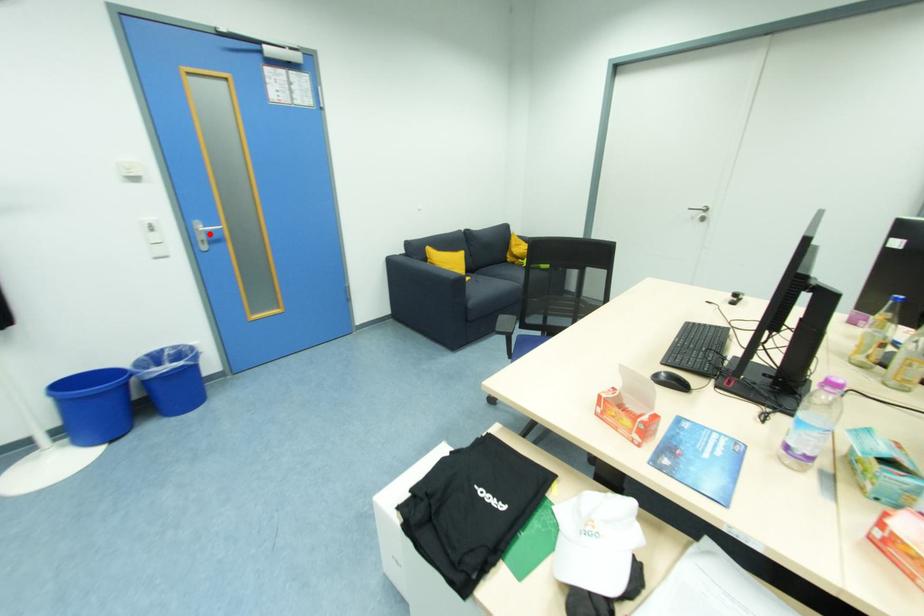
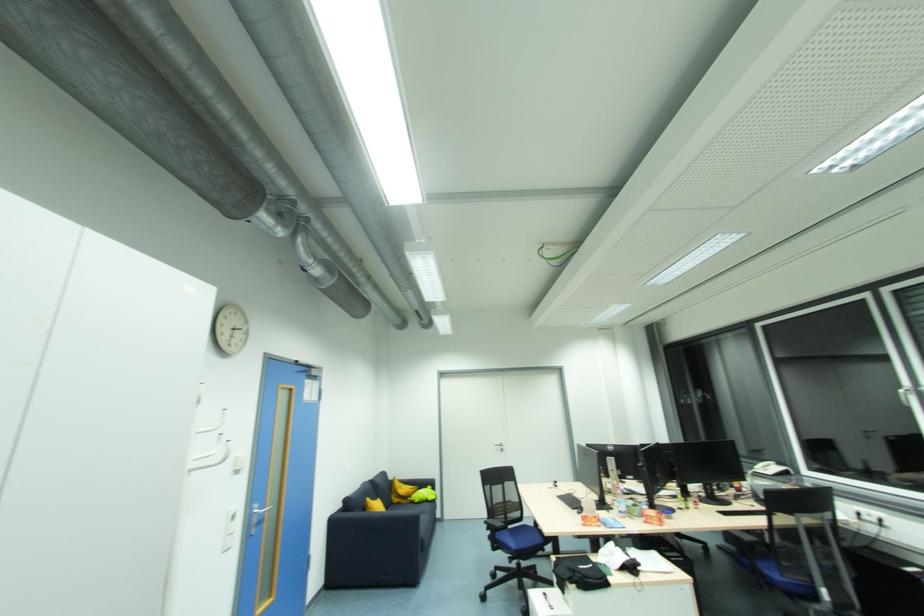
Find the pixel in the second image that matches the highlighted location in the first image.

(261, 517)